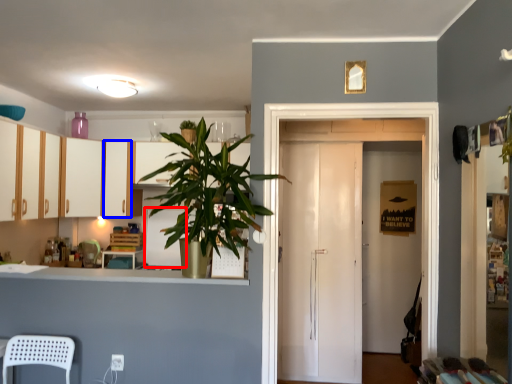
Question: Which object is further to the camera taking this photo, appliance (highlighted by a red box) or cabinetry (highlighted by a blue box)?

Choices:
 (A) appliance
 (B) cabinetry

Answer: (A)